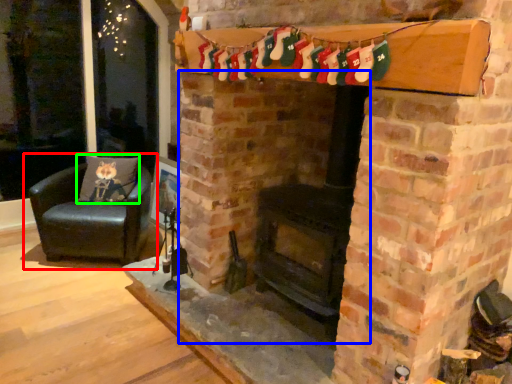
Question: Which object is the farthest from chair (highlighted by a red box)? Choose among these: fireplace (highlighted by a blue box) or pillow (highlighted by a green box).

Choices:
 (A) fireplace
 (B) pillow

Answer: (A)